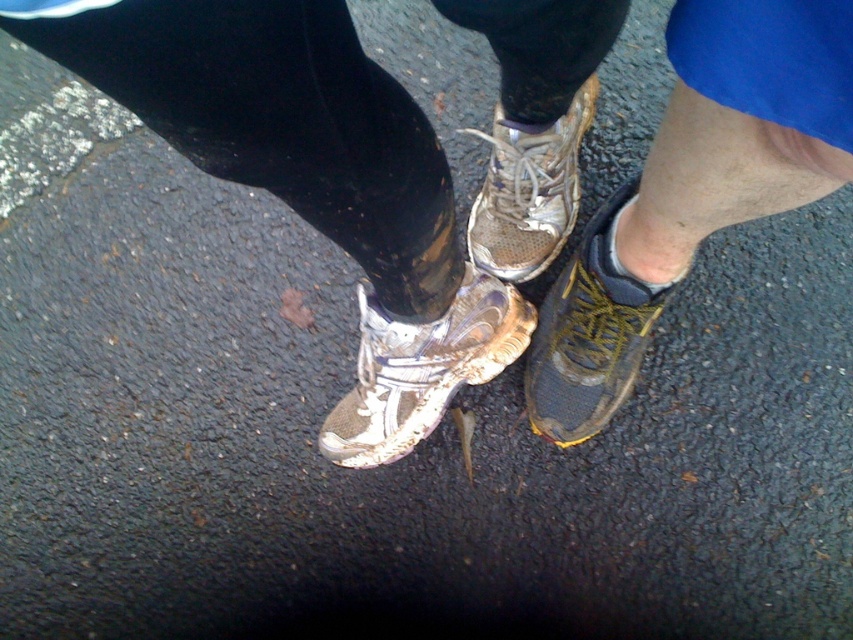
You are a photographer trying to capture both the shiny white running shoe at center and the shiny black shoe at lower right in a single frame. Based on their positions, do you think you can include both shoes in your shot without moving either of them?

The shiny white running shoe at center is positioned under the shiny black shoe at lower right, so yes, both shoes can be included in the frame as they are already aligned vertically.

You are taking a photo of two people standing on a paved path. You notice two points marked as point 1 at coordinates (634, 291) and point 2 at (549, 136). If you want to focus on the point closer to the camera, which point should you choose?

Point 1 at coordinates (634, 291) is closer to the camera than point 2 at (549, 136), so you should choose point 1 to focus on.

Based on the photo, you are standing at point point (612, 253) and want to place a 1.2 meter long ladder horizontally. Can you fit the ladder without it overlapping any objects?

The distance between point point (612, 253) and the viewer is 1.04 meters, which is shorter than the ladder length. Therefore, the ladder cannot be placed horizontally here without overlapping objects.